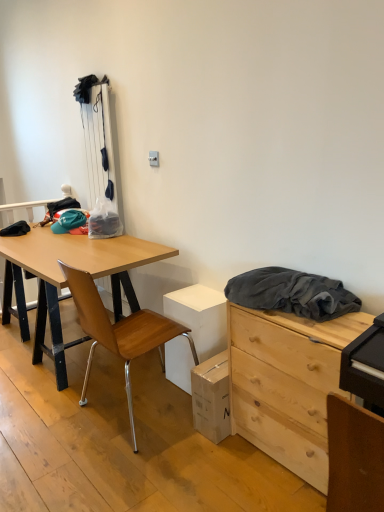
Question: Does wooden at left appear on the left side of natural wood chest of drawers at right?

Choices:
 (A) yes
 (B) no

Answer: (A)

Question: Is wooden at left with natural wood chest of drawers at right?

Choices:
 (A) yes
 (B) no

Answer: (B)

Question: Considering the relative sizes of wooden at left and natural wood chest of drawers at right in the image provided, is wooden at left bigger than natural wood chest of drawers at right?

Choices:
 (A) yes
 (B) no

Answer: (A)

Question: Is wooden at left wider than natural wood chest of drawers at right?

Choices:
 (A) no
 (B) yes

Answer: (B)

Question: Does wooden at left appear on the right side of natural wood chest of drawers at right?

Choices:
 (A) yes
 (B) no

Answer: (B)

Question: Considering the relative positions of dark gray fabric at upper right and wooden at left in the image provided, is dark gray fabric at upper right to the left or to the right of wooden at left?

Choices:
 (A) left
 (B) right

Answer: (B)

Question: Considering the positions of dark gray fabric at upper right and wooden at left in the image, is dark gray fabric at upper right bigger or smaller than wooden at left?

Choices:
 (A) small
 (B) big

Answer: (A)

Question: In terms of width, does dark gray fabric at upper right look wider or thinner when compared to wooden at left?

Choices:
 (A) thin
 (B) wide

Answer: (A)

Question: From the image's perspective, is dark gray fabric at upper right positioned above or below wooden at left?

Choices:
 (A) above
 (B) below

Answer: (A)

Question: Visually, is wooden at left positioned to the left or to the right of natural wood chest of drawers at right?

Choices:
 (A) left
 (B) right

Answer: (A)

Question: Is wooden at left bigger or smaller than natural wood chest of drawers at right?

Choices:
 (A) small
 (B) big

Answer: (B)

Question: From the image's perspective, is wooden at left located above or below natural wood chest of drawers at right?

Choices:
 (A) below
 (B) above

Answer: (B)

Question: Considering their positions, is wooden at left located in front of or behind natural wood chest of drawers at right?

Choices:
 (A) front
 (B) behind

Answer: (B)

Question: Which is correct: natural wood chest of drawers at right is inside wooden at left, or outside of it?

Choices:
 (A) inside
 (B) outside

Answer: (B)

Question: Is natural wood chest of drawers at right in front of or behind wooden at left in the image?

Choices:
 (A) front
 (B) behind

Answer: (A)